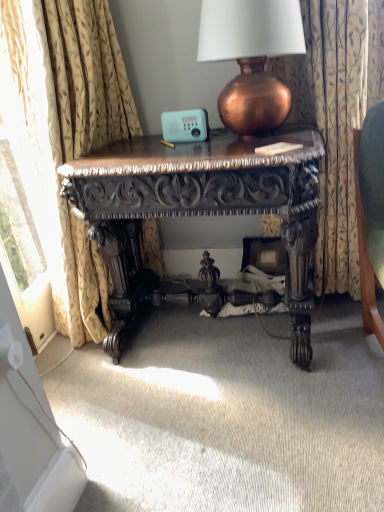
Question: Does copper metallic lamp at upper center appear on the right side of floral fabric curtain at right, which is the first curtain from right to left?

Choices:
 (A) yes
 (B) no

Answer: (B)

Question: From a real-world perspective, is copper metallic lamp at upper center located higher than floral fabric curtain at right, which is the first curtain from right to left?

Choices:
 (A) yes
 (B) no

Answer: (A)

Question: Is the position of copper metallic lamp at upper center more distant than that of floral fabric curtain at right, the 2th curtain in the left-to-right sequence?

Choices:
 (A) yes
 (B) no

Answer: (B)

Question: Is copper metallic lamp at upper center at the left side of floral fabric curtain at right, the 2th curtain in the left-to-right sequence?

Choices:
 (A) yes
 (B) no

Answer: (A)

Question: Is copper metallic lamp at upper center directly adjacent to floral fabric curtain at right, the 2th curtain in the left-to-right sequence?

Choices:
 (A) no
 (B) yes

Answer: (A)

Question: Can you confirm if copper metallic lamp at upper center is smaller than floral fabric curtain at right, the 2th curtain in the left-to-right sequence?

Choices:
 (A) no
 (B) yes

Answer: (B)

Question: Is floral fabric curtain at right, the 2th curtain in the left-to-right sequence, smaller than gold floral fabric curtain at left, the 2th curtain from the right?

Choices:
 (A) no
 (B) yes

Answer: (B)

Question: Can you confirm if floral fabric curtain at right, the 2th curtain in the left-to-right sequence, is bigger than gold floral fabric curtain at left, which is the first curtain in left-to-right order?

Choices:
 (A) yes
 (B) no

Answer: (B)

Question: Is floral fabric curtain at right, which is the first curtain from right to left, facing away from gold floral fabric curtain at left, the 2th curtain from the right?

Choices:
 (A) yes
 (B) no

Answer: (B)

Question: Is floral fabric curtain at right, which is the first curtain from right to left, next to gold floral fabric curtain at left, the 2th curtain from the right, and touching it?

Choices:
 (A) yes
 (B) no

Answer: (B)

Question: Is there a large distance between floral fabric curtain at right, which is the first curtain from right to left, and gold floral fabric curtain at left, which is the first curtain in left-to-right order?

Choices:
 (A) yes
 (B) no

Answer: (B)

Question: Does floral fabric curtain at right, which is the first curtain from right to left, lie in front of gold floral fabric curtain at left, the 2th curtain from the right?

Choices:
 (A) no
 (B) yes

Answer: (A)

Question: Considering the relative sizes of polished dark wood desk at center and floral fabric curtain at right, the 2th curtain in the left-to-right sequence, in the image provided, is polished dark wood desk at center bigger than floral fabric curtain at right, the 2th curtain in the left-to-right sequence,?

Choices:
 (A) no
 (B) yes

Answer: (B)